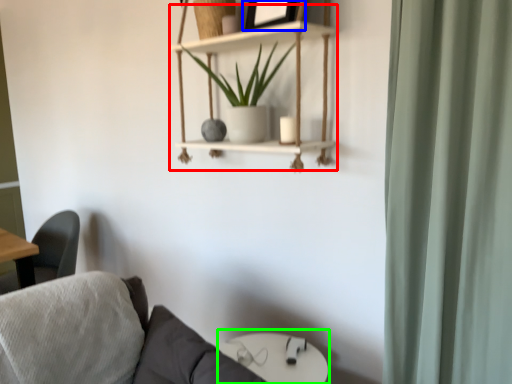
Question: Based on their relative distances, which object is farther from cabinet (highlighted by a red box)? Choose from picture frame (highlighted by a blue box) and round table (highlighted by a green box).

Choices:
 (A) picture frame
 (B) round table

Answer: (B)